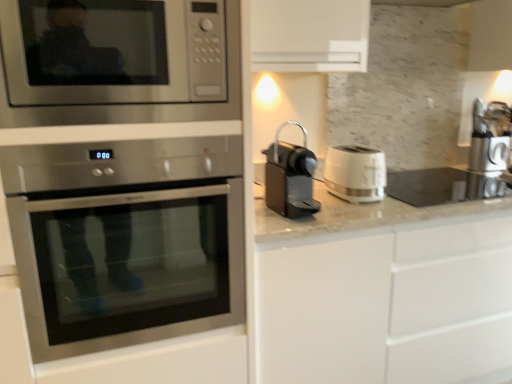
Question: Is the position of black plastic coffee machine at center, the 2th coffee machine when ordered from right to left, more distant than that of white plastic toaster at right?

Choices:
 (A) yes
 (B) no

Answer: (B)

Question: Does black plastic coffee machine at center, which ranks as the first coffee machine in left-to-right order, have a lesser width compared to white plastic toaster at right?

Choices:
 (A) no
 (B) yes

Answer: (B)

Question: Is white plastic toaster at right at the back of black plastic coffee machine at center, the first coffee machine from the front?

Choices:
 (A) yes
 (B) no

Answer: (B)

Question: Can you confirm if black plastic coffee machine at center, which ranks as the second coffee machine in back-to-front order, is positioned to the right of white plastic toaster at right?

Choices:
 (A) no
 (B) yes

Answer: (A)

Question: Would you say black plastic coffee machine at center, the 2th coffee machine when ordered from right to left, is outside white plastic toaster at right?

Choices:
 (A) yes
 (B) no

Answer: (A)

Question: In terms of size, does white plastic toaster at right appear bigger or smaller than black plastic coffee machine at center, the first coffee machine from the front?

Choices:
 (A) small
 (B) big

Answer: (A)

Question: Looking at their shapes, would you say white plastic toaster at right is wider or thinner than black plastic coffee machine at center, the first coffee machine from the front?

Choices:
 (A) wide
 (B) thin

Answer: (A)

Question: Is white plastic toaster at right situated inside black plastic coffee machine at center, which ranks as the first coffee machine in left-to-right order, or outside?

Choices:
 (A) outside
 (B) inside

Answer: (A)

Question: From the image's perspective, is white plastic toaster at right positioned above or below black plastic coffee machine at center, the 2th coffee machine when ordered from right to left?

Choices:
 (A) above
 (B) below

Answer: (A)

Question: Is satin silver coffee machine at right, the 2th coffee machine when ordered from front to back, bigger or smaller than black plastic coffee machine at center, the 2th coffee machine when ordered from right to left?

Choices:
 (A) small
 (B) big

Answer: (B)

Question: Considering the positions of satin silver coffee machine at right, the 1th coffee machine viewed from the right, and black plastic coffee machine at center, which ranks as the second coffee machine in back-to-front order, in the image, is satin silver coffee machine at right, the 1th coffee machine viewed from the right, taller or shorter than black plastic coffee machine at center, which ranks as the second coffee machine in back-to-front order,?

Choices:
 (A) tall
 (B) short

Answer: (A)

Question: Relative to black plastic coffee machine at center, the 2th coffee machine when ordered from right to left, is satin silver coffee machine at right, the second coffee machine from the left, in front or behind?

Choices:
 (A) front
 (B) behind

Answer: (B)

Question: In terms of width, does satin silver coffee machine at right, the second coffee machine from the left, look wider or thinner when compared to black plastic coffee machine at center, which ranks as the first coffee machine in left-to-right order?

Choices:
 (A) wide
 (B) thin

Answer: (A)

Question: Is stainless steel oven at left wider or thinner than stainless steel microwave at upper left?

Choices:
 (A) wide
 (B) thin

Answer: (A)

Question: Considering their positions, is stainless steel oven at left located in front of or behind stainless steel microwave at upper left?

Choices:
 (A) front
 (B) behind

Answer: (B)